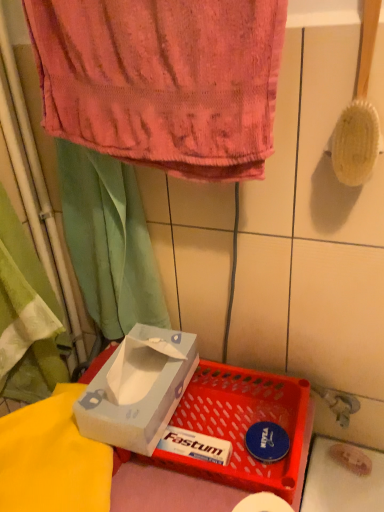
Question: From their relative heights in the image, would you say green fabric curtain at upper left is taller or shorter than wooden bristles brush at upper right?

Choices:
 (A) tall
 (B) short

Answer: (A)

Question: Is point (66, 168) positioned closer to the camera than point (355, 157)?

Choices:
 (A) farther
 (B) closer

Answer: (A)

Question: Considering the real-world distances, which object is closest to the light blue cardboard tissue box at center?

Choices:
 (A) wooden bristles brush at upper right
 (B) green fabric curtain at upper left
 (C) translucent plastic tray at lower center
 (D) pink terry cloth towel at upper center

Answer: (C)

Question: Which is nearer to the wooden bristles brush at upper right?

Choices:
 (A) green fabric curtain at upper left
 (B) light blue cardboard tissue box at center
 (C) pink terry cloth towel at upper center
 (D) translucent plastic tray at lower center

Answer: (C)